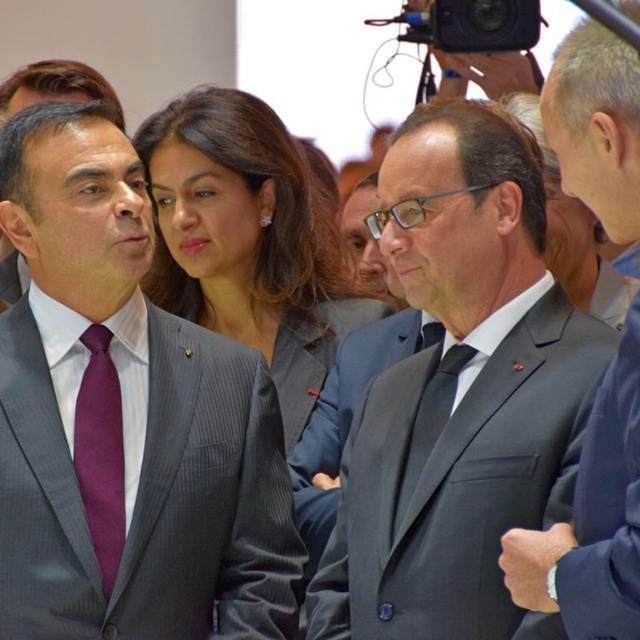
You are standing at the point labeled as point (93, 412) and want to move to the point labeled as point (173, 145). Can you directly walk towards it without any obstacles in between?

Yes, you can directly walk towards point (173, 145) from point (93, 412) because there are no obstacles mentioned between them in the scene description.